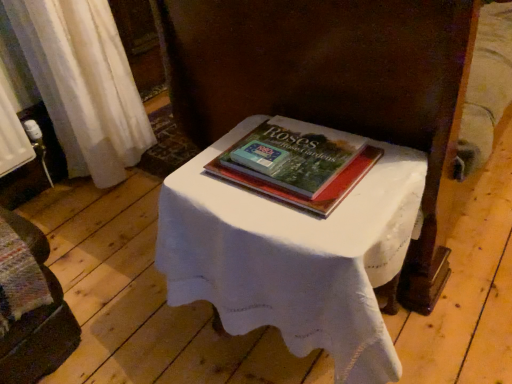
Question: Does point (25, 233) appear closer or farther from the camera than point (283, 188)?

Choices:
 (A) farther
 (B) closer

Answer: (A)

Question: Is wooden bench at lower left in front of or behind hardcover book at center in the image?

Choices:
 (A) front
 (B) behind

Answer: (A)

Question: Estimate the real-world distances between objects in this image. Which object is farther from the wooden bench at lower left?

Choices:
 (A) white cloth-covered table at center
 (B) hardcover book at center

Answer: (B)

Question: Which object is positioned farthest from the wooden bench at lower left?

Choices:
 (A) white cloth-covered table at center
 (B) hardcover book at center

Answer: (B)